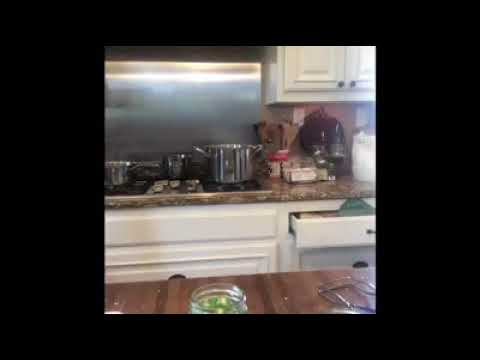
Locate an element on the screen. The width and height of the screenshot is (480, 360). pot is located at coordinates (117, 175).